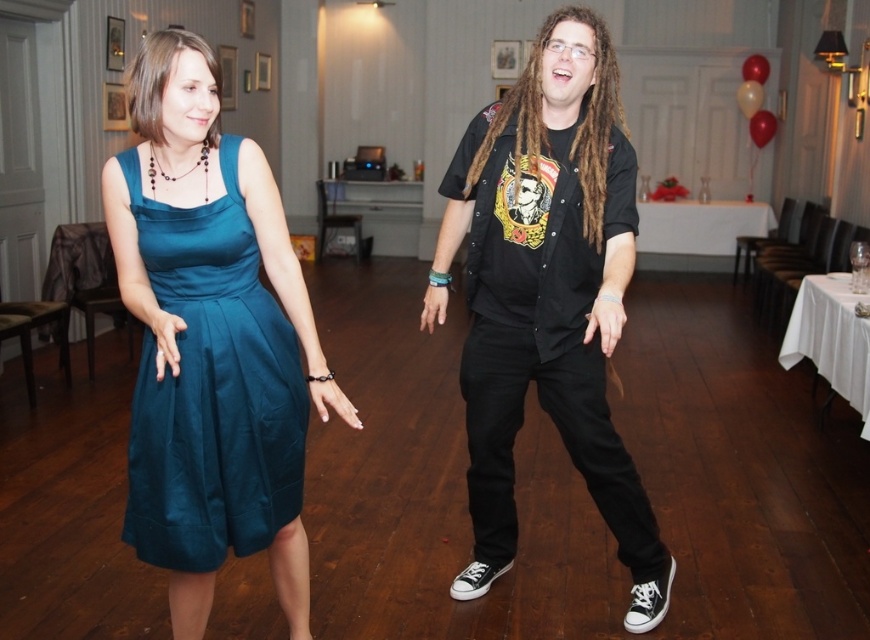
You are a photographer at a dance event and need to capture a clear photo of both the black matte shirt at center and the teal satin dress at left. Based on their positions, which one is closer to the camera?

The black matte shirt at center is positioned over the teal satin dress at left, meaning it is closer to the camera.

You are a photographer positioned at the back of the room. You want to take a photo of both the black matte shirt at center and the teal satin dress at left. Which one will appear closer to you in the photo?

The black matte shirt at center will appear closer to you in the photo because it is positioned further to the viewer compared to the teal satin dress at left.